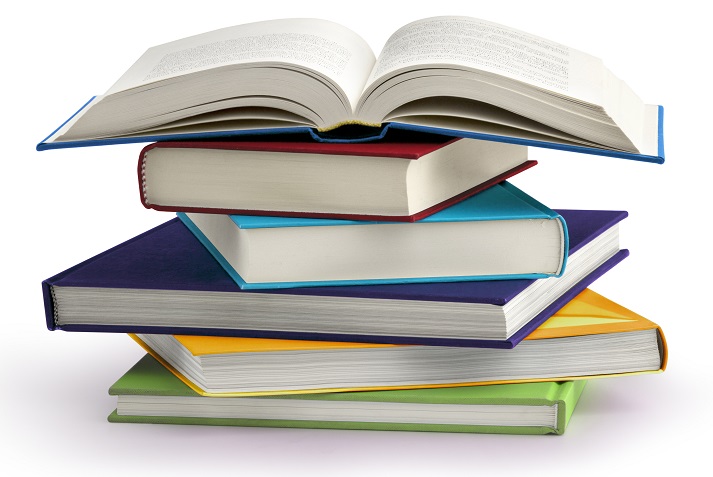
Locate an element on the screen. Image resolution: width=713 pixels, height=477 pixels. books is located at coordinates (463, 415), (358, 363), (373, 321), (406, 262), (381, 188), (322, 106).